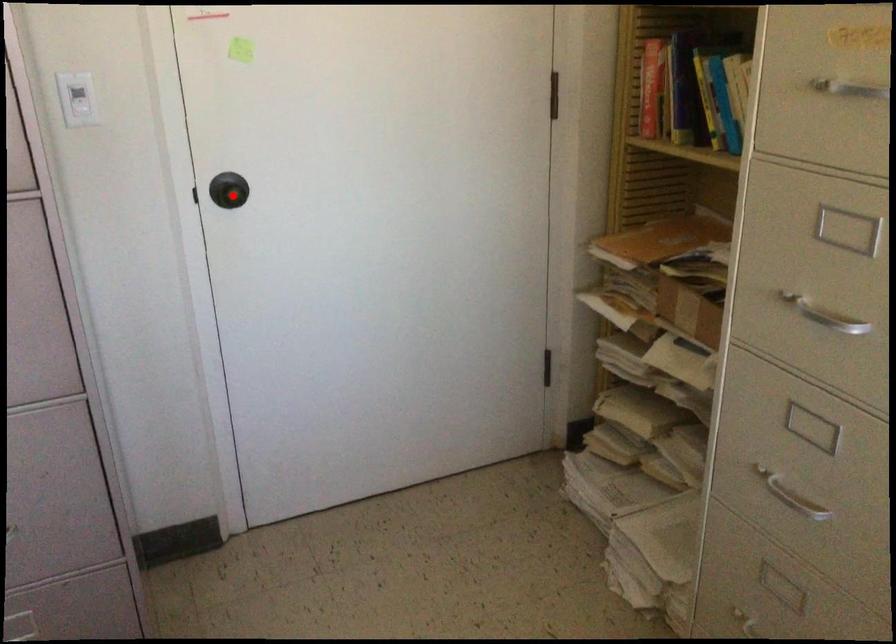
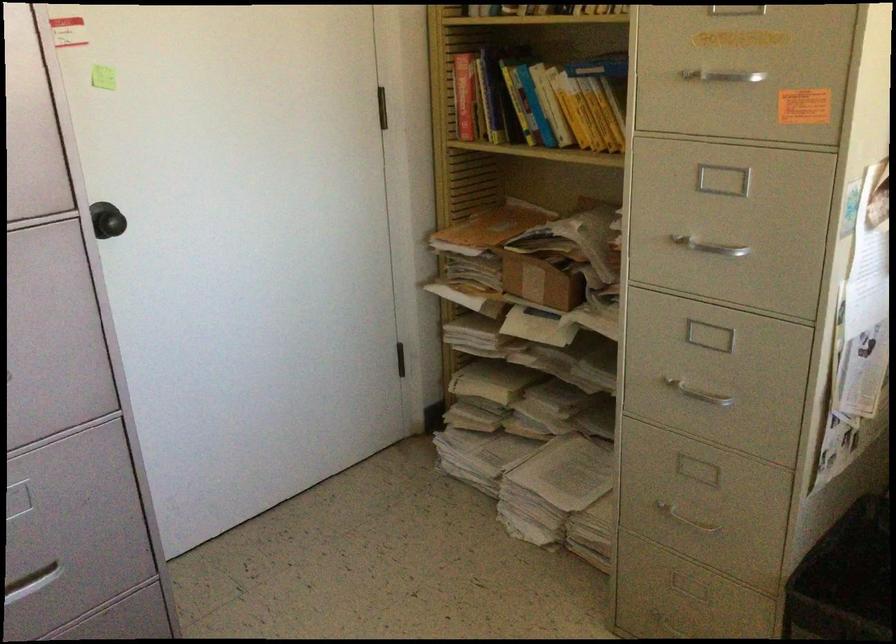
In the second image, find the point that corresponds to the highlighted location in the first image.

(115, 223)